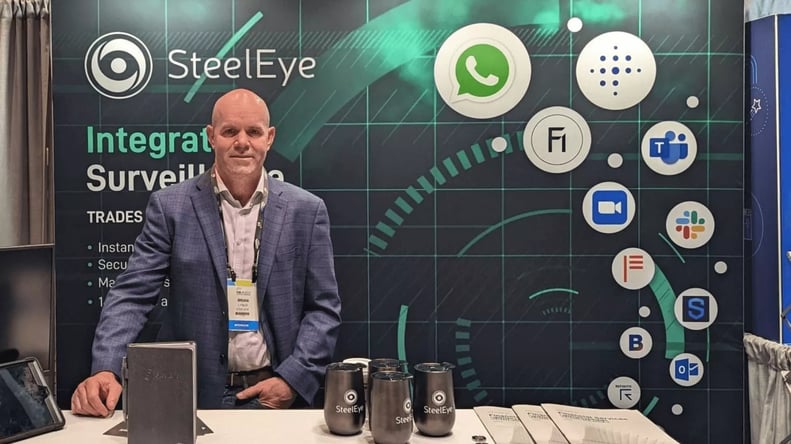
Find the location of a particular element. The image size is (791, 444). curtain is located at coordinates pyautogui.click(x=31, y=56), pyautogui.click(x=766, y=392).